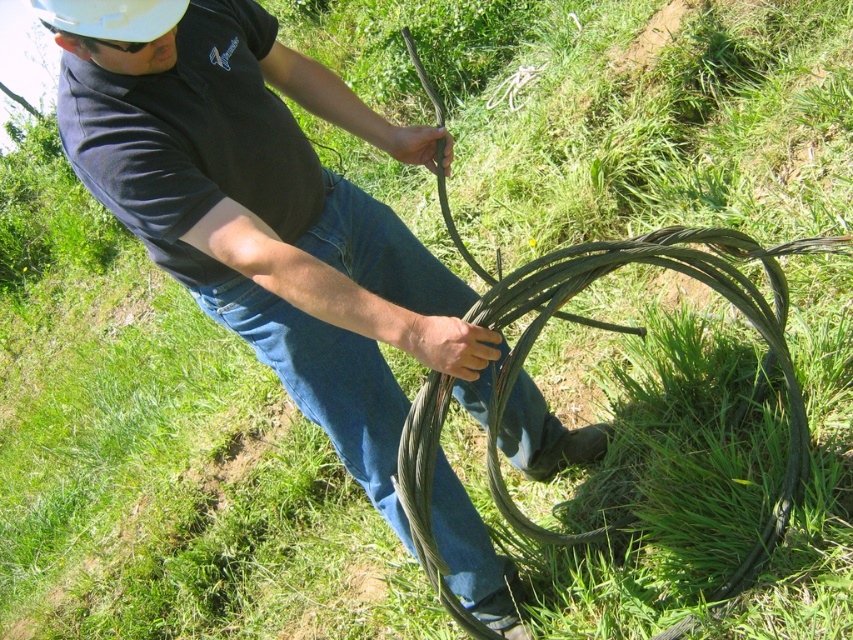
Question: Estimate the real-world distances between objects in this image. Which object is farther from the white matte hardhat at upper left?

Choices:
 (A) matte black cable at center
 (B) blue denim jeans at center

Answer: (B)

Question: Does matte black cable at center appear over white matte hardhat at upper left?

Choices:
 (A) no
 (B) yes

Answer: (A)

Question: Which object is farther from the camera taking this photo?

Choices:
 (A) white matte hardhat at upper left
 (B) matte black cable at center

Answer: (B)

Question: Is matte black cable at center to the left of blue denim jeans at center from the viewer's perspective?

Choices:
 (A) no
 (B) yes

Answer: (B)

Question: Which of the following is the closest to the observer?

Choices:
 (A) white matte hardhat at upper left
 (B) matte black cable at center
 (C) blue denim jeans at center

Answer: (A)

Question: Does matte black cable at center have a lesser width compared to blue denim jeans at center?

Choices:
 (A) no
 (B) yes

Answer: (A)